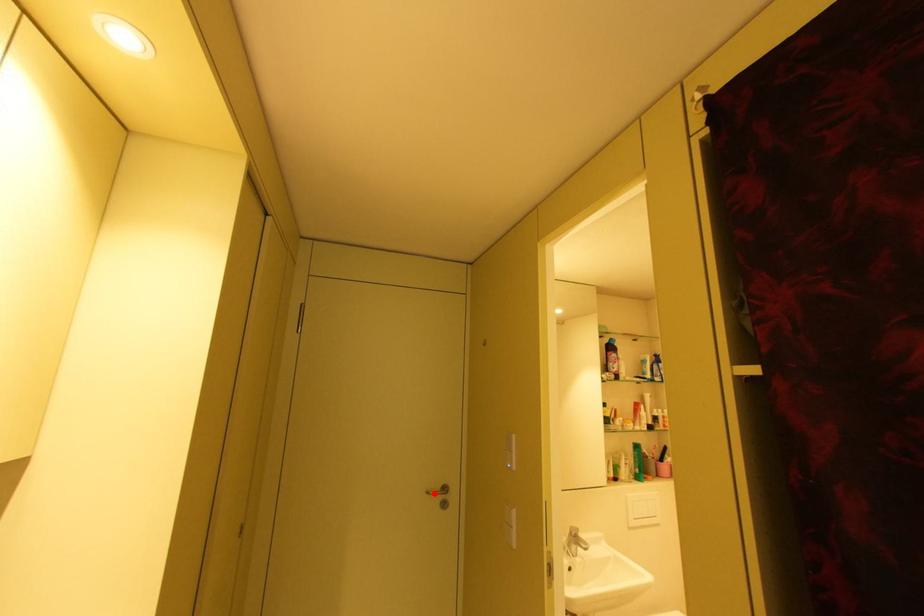
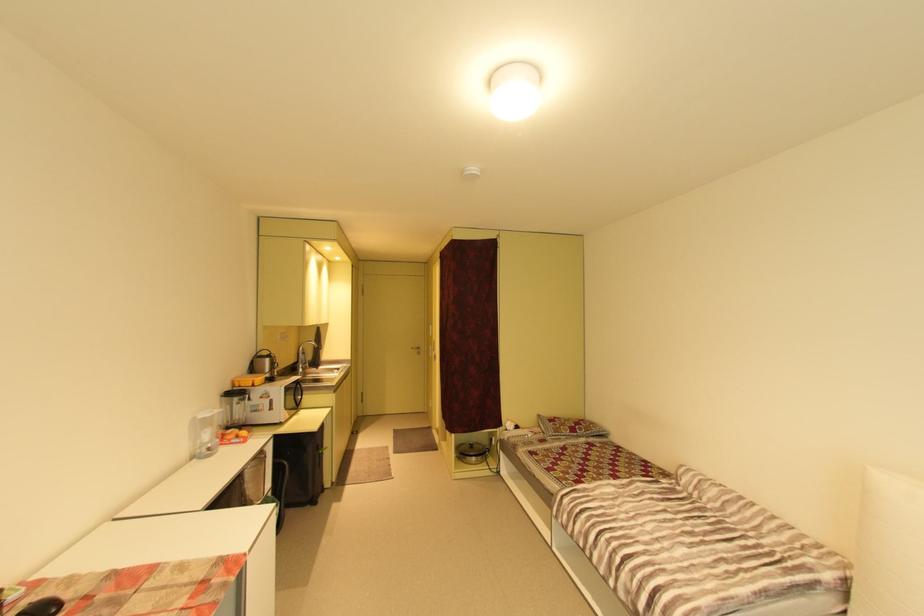
The point at the highlighted location is marked in the first image. Where is the corresponding point in the second image?

(419, 349)